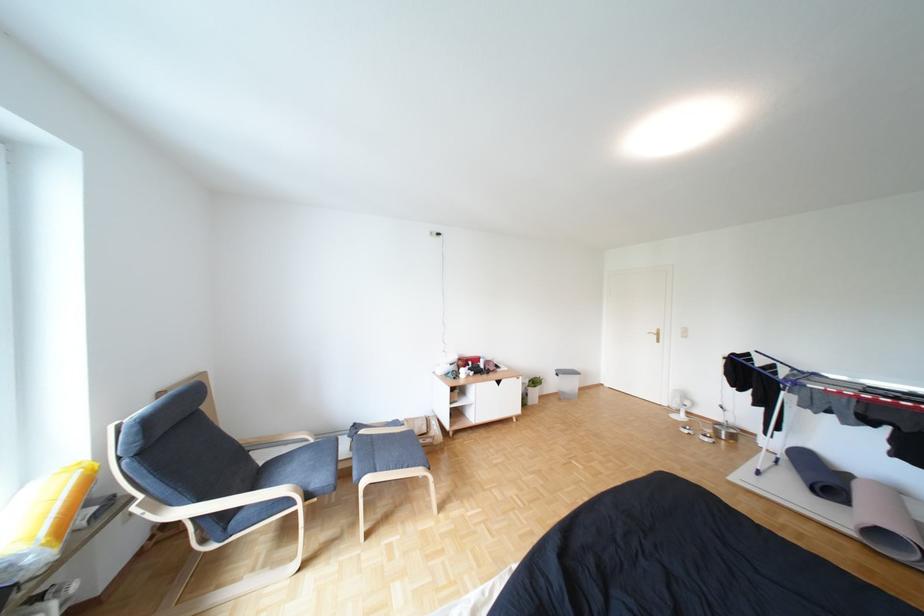
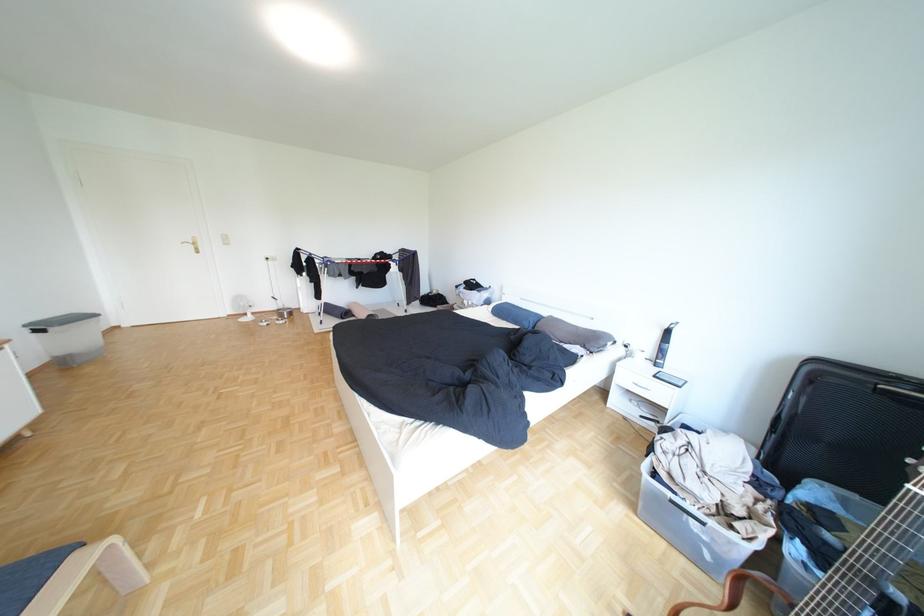
Locate, in the second image, the point that corresponds to [733,416] in the first image.

(286, 307)